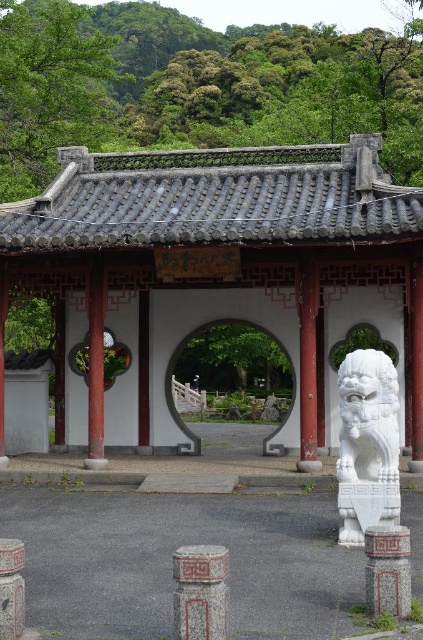
You are standing in a park and want to take a photo of the white stone gazebo at center. If your camera has a maximum focus range of 50 feet, will it be able to capture the gazebo clearly?

The white stone gazebo at center is 49.42 feet away from you. Since this distance is within the camera maximum focus range of 50 feet, the camera can capture the gazebo clearly.

You are an architect designing a new garden path that must pass between the carved stone pillar at center and the white stone archway at center. The path must be at least 1 meter wide to accommodate visitors. Based on the scene description, is the space between these two structures wide enough for the path?

The carved stone pillar at center is narrower than the white stone archway at center. However, the exact width between them isn not specified. Without knowing the distance between the pillar and archway, it is impossible to determine if the 1 meter path requirement is met.